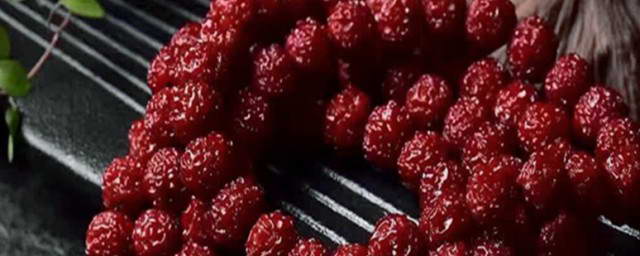
Image resolution: width=640 pixels, height=256 pixels. In order to click on grey wood in this screenshot , I will do `click(605, 29)`.